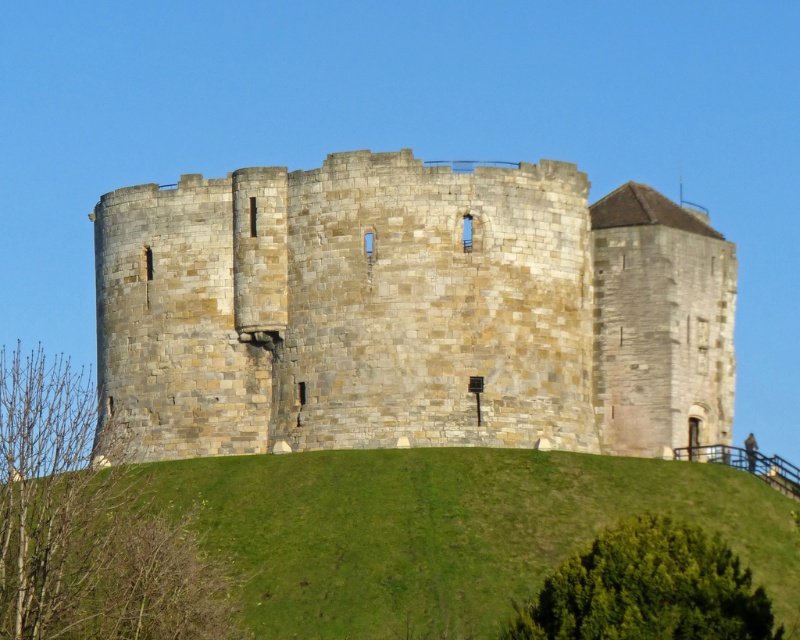
You are a visitor standing at the base of the stone tower at center and the green grassy hill at center. Which structure is taller?

The stone tower at center is taller than the green grassy hill at center according to the description.

You are standing at the base of the castle and want to reach the stone tower at center. Which direction should you move relative to the green grassy hill at center?

You should move towards the stone tower at center, which is located above the green grassy hill at center. Since the stone tower is above the hill, you would need to ascend the hill towards the center to reach it.

You are standing at the base of the castle and want to walk towards the stone tower at center. Which direction should you head relative to the green grassy hill at center?

You should head to the left relative to the green grassy hill at center because the stone tower at center is positioned to the left of the green grassy hill at center.